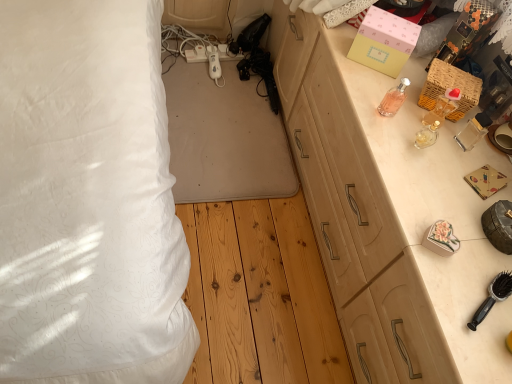
Identify the location of free space between black plastic brush at lower right and clear glass perfume at upper right, marked as the 3th perfume in a left-to-right arrangement. The width and height of the screenshot is (512, 384). (452, 204).